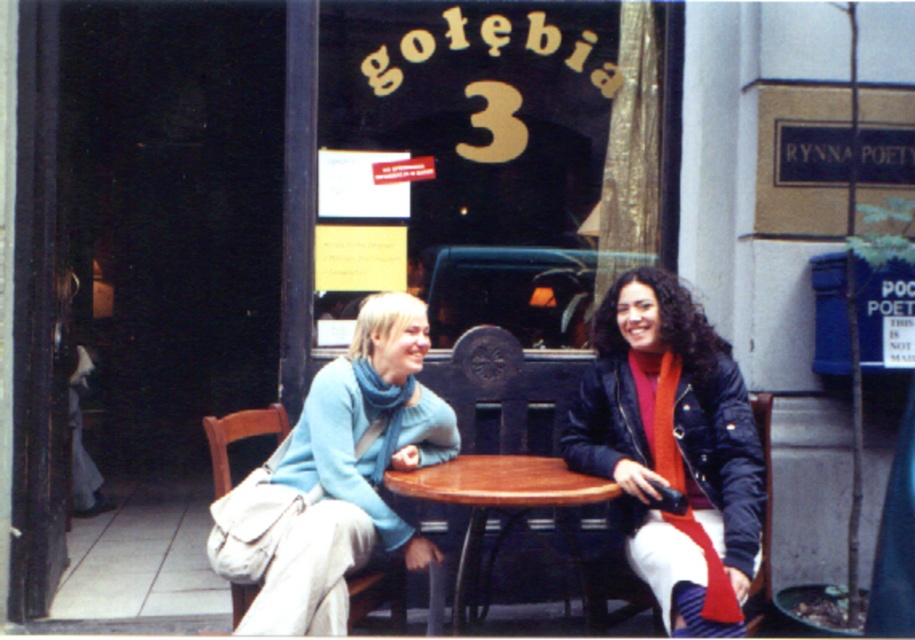
Does matte black jacket at center have a lesser width compared to wooden table at center?

Yes.

This screenshot has width=915, height=640. Describe the element at coordinates (673, 451) in the screenshot. I see `matte black jacket at center` at that location.

Describe the element at coordinates (673, 451) in the screenshot. I see `matte black jacket at center` at that location.

This screenshot has height=640, width=915. I want to click on matte black jacket at center, so click(673, 451).

Can you confirm if light blue sweater at center is taller than wooden table at center?

Correct, light blue sweater at center is much taller as wooden table at center.

Who is lower down, light blue sweater at center or wooden table at center?

wooden table at center is lower down.

I want to click on light blue sweater at center, so click(351, 472).

Between matte black jacket at center and light blue sweater at center, which one is positioned higher?

matte black jacket at center

Which is in front, point (634, 424) or point (332, 490)?

Point (332, 490)

Identify the location of matte black jacket at center. (673, 451).